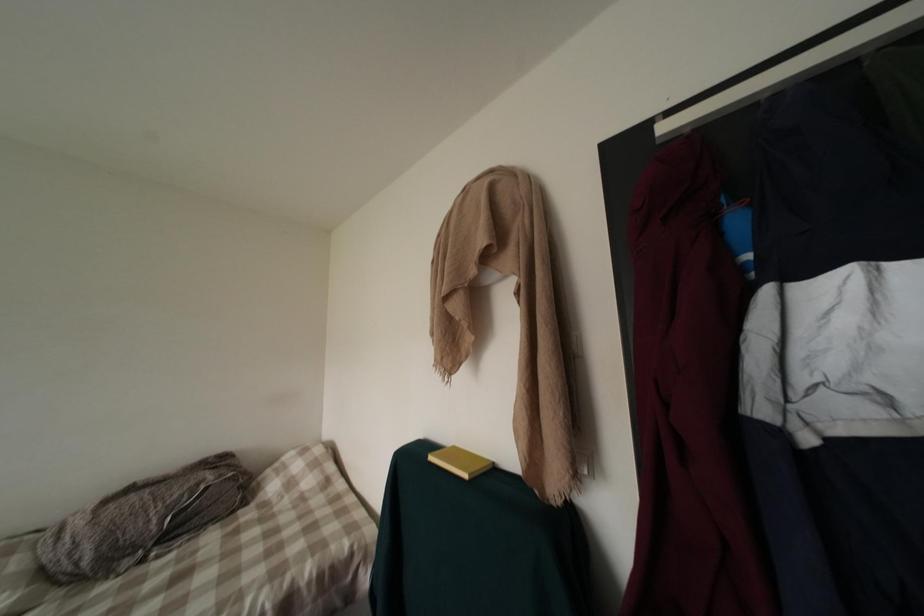
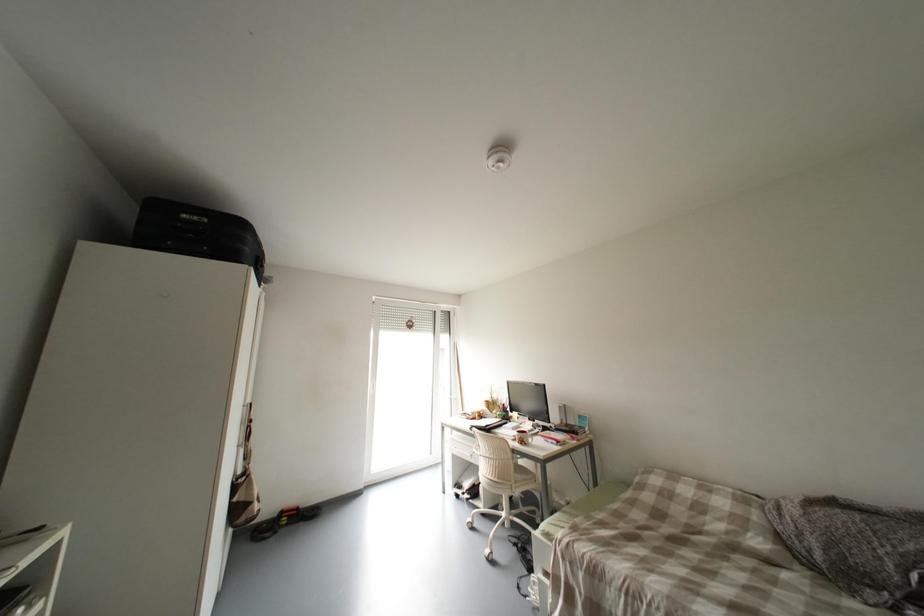
Question: How did the camera likely rotate?

Choices:
 (A) Left
 (B) Right
 (C) Up
 (D) Down

Answer: (A)